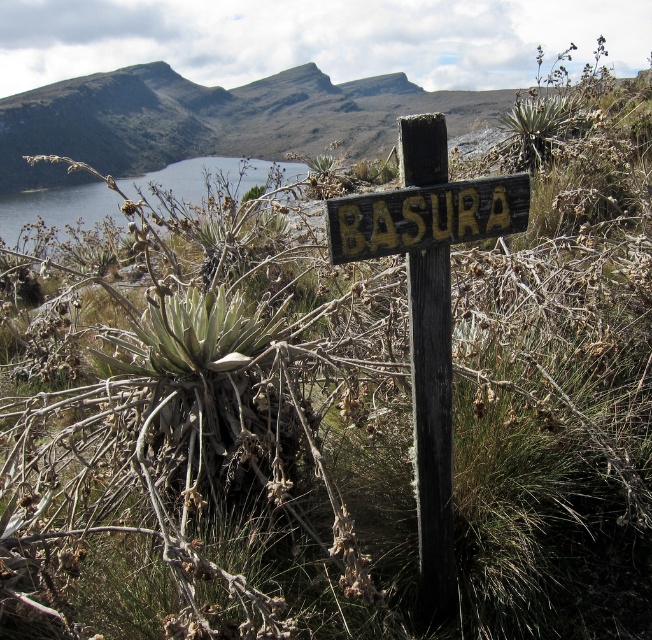
Does wooden sign at center have a lesser height compared to yellow painted wood sign at center?

No.

This screenshot has height=640, width=652. What do you see at coordinates (428, 308) in the screenshot?
I see `wooden sign at center` at bounding box center [428, 308].

This screenshot has width=652, height=640. Find the location of `wooden sign at center`. wooden sign at center is located at coordinates (428, 308).